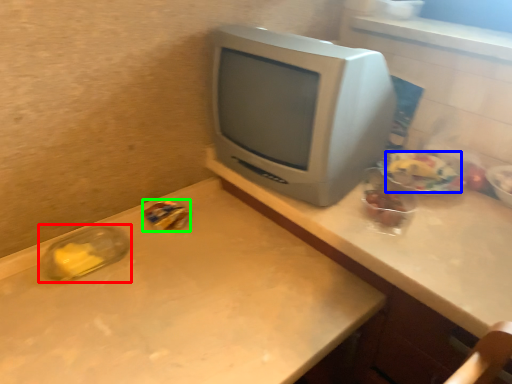
Question: Which is nearer to the glass jar (highlighted by a red box)? food (highlighted by a blue box) or food (highlighted by a green box).

Choices:
 (A) food
 (B) food

Answer: (B)